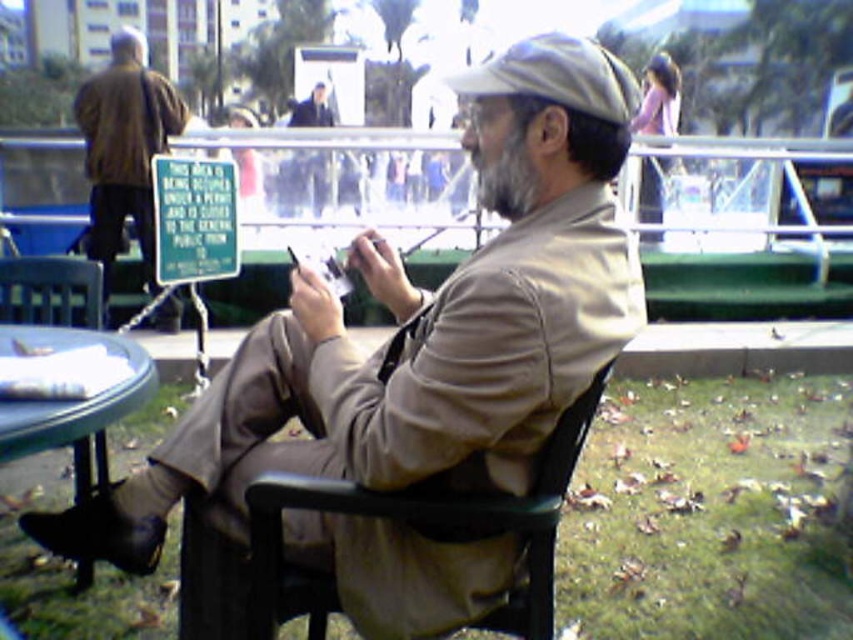
Question: Can you confirm if green plastic table at lower left is wider than brown leather jacket at upper left?

Choices:
 (A) yes
 (B) no

Answer: (B)

Question: Is matte khaki jacket at center in front of brown leather jacket at upper left?

Choices:
 (A) yes
 (B) no

Answer: (A)

Question: Is matte khaki jacket at center wider than brown leather jacket at upper left?

Choices:
 (A) yes
 (B) no

Answer: (B)

Question: Among these objects, which one is nearest to the camera?

Choices:
 (A) black plastic chair at center
 (B) green plastic table at lower left
 (C) brown leather jacket at upper left
 (D) matte khaki jacket at center

Answer: (D)

Question: Which of the following is the farthest from the observer?

Choices:
 (A) black plastic chair at center
 (B) green plastic table at lower left
 (C) brown leather jacket at upper left

Answer: (C)

Question: Which of the following is the closest to the observer?

Choices:
 (A) brown leather jacket at upper left
 (B) matte khaki jacket at center

Answer: (B)